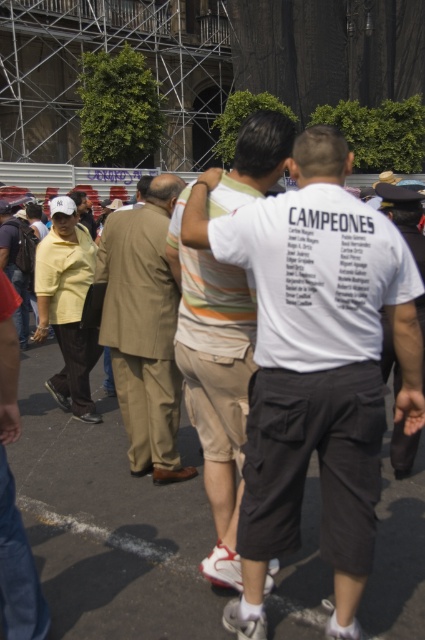
Question: Which point is farther to the camera?

Choices:
 (A) light brown suit at center
 (B) white cotton t-shirt at center
 (C) white cotton shirt at right
 (D) white cotton shirt at center

Answer: (A)

Question: Does light brown suit at center have a greater width compared to white cotton shirt at right?

Choices:
 (A) yes
 (B) no

Answer: (A)

Question: Which point is farther to the camera?

Choices:
 (A) white cotton shirt at center
 (B) white cotton shirt at right

Answer: (B)

Question: Which object is the farthest from the light brown suit at center?

Choices:
 (A) white cotton shirt at center
 (B) white cotton t-shirt at center

Answer: (B)

Question: Can you confirm if white cotton t-shirt at center is thinner than white cotton shirt at right?

Choices:
 (A) yes
 (B) no

Answer: (B)

Question: Does light brown suit at center have a smaller size compared to white cotton shirt at right?

Choices:
 (A) no
 (B) yes

Answer: (A)